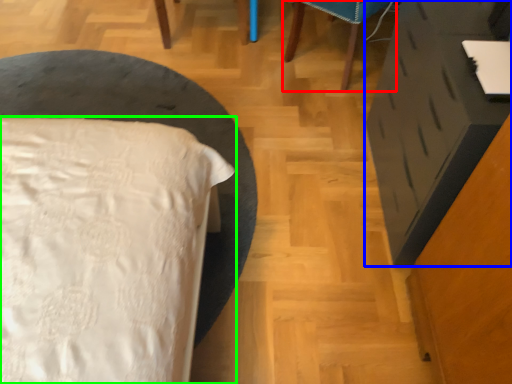
Question: Which is nearer to the furniture (highlighted by a red box)? vanity (highlighted by a blue box) or bed (highlighted by a green box).

Choices:
 (A) vanity
 (B) bed

Answer: (A)